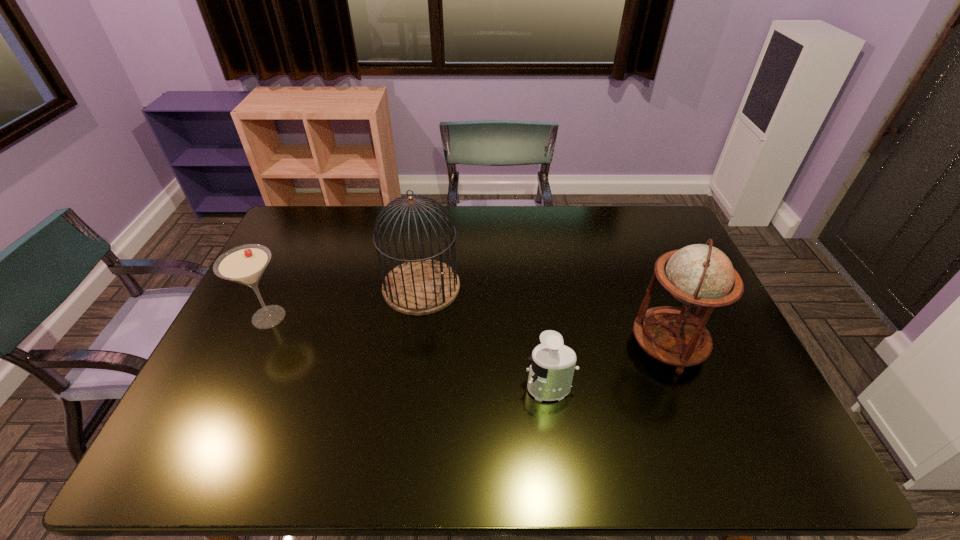
Where is `blank space located on the left of the shortest object`? The height and width of the screenshot is (540, 960). blank space located on the left of the shortest object is located at coordinates (449, 388).

What are the coordinates of `object that is at the left edge` in the screenshot? It's located at (245, 264).

At what (x,y) coordinates should I click in order to perform the action: click on object that is at the right edge. Please return your answer as a coordinate pair (x, y). The height and width of the screenshot is (540, 960). Looking at the image, I should click on (700, 275).

Where is `vacant region at the far edge of the desktop`? vacant region at the far edge of the desktop is located at coordinates (596, 239).

Where is `vacant space at the near edge of the desktop`? vacant space at the near edge of the desktop is located at coordinates (323, 435).

This screenshot has width=960, height=540. In the image, there is a desktop. In order to click on vacant space at the left edge in this screenshot , I will do point(314,254).

I want to click on vacant region at the right edge of the desktop, so click(x=738, y=370).

This screenshot has width=960, height=540. In the image, there is a desktop. Identify the location of vacant space at the far left corner. (324, 211).

I want to click on vacant region at the near right corner of the desktop, so click(x=803, y=470).

At what (x,y) coordinates should I click in order to perform the action: click on free space between the rightmost object and the leftmost object. Please return your answer as a coordinate pair (x, y). The image size is (960, 540). Looking at the image, I should click on (468, 331).